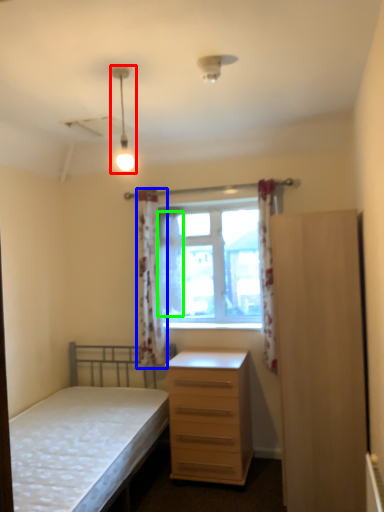
Question: Which object is the closest to the light fixture (highlighted by a red box)? Choose among these: curtain (highlighted by a blue box) or curtain (highlighted by a green box).

Choices:
 (A) curtain
 (B) curtain

Answer: (B)